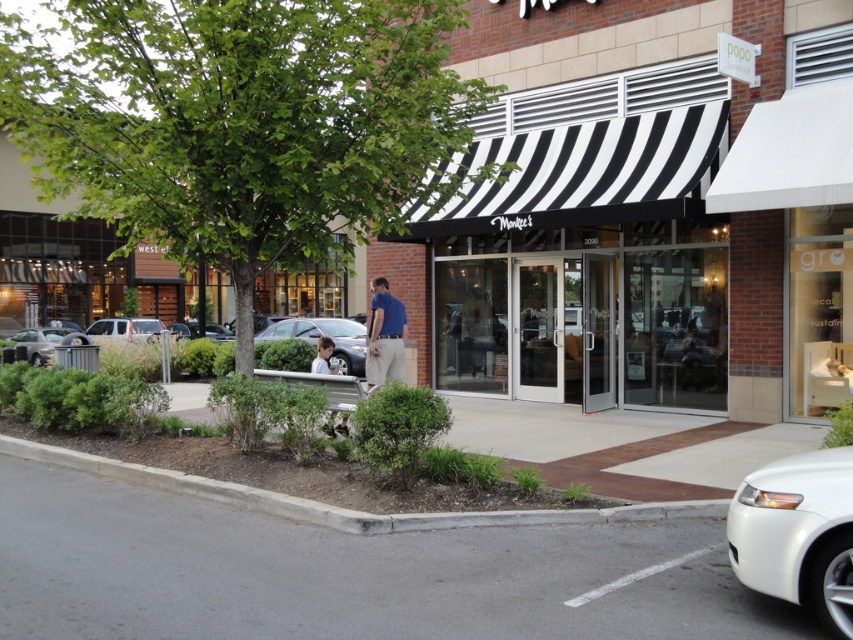
Does white glossy sedan at lower right have a lesser height compared to light blue shirt at center?

Indeed, white glossy sedan at lower right has a lesser height compared to light blue shirt at center.

The image size is (853, 640). What do you see at coordinates (798, 532) in the screenshot? I see `white glossy sedan at lower right` at bounding box center [798, 532].

This screenshot has width=853, height=640. In order to click on white glossy sedan at lower right in this screenshot , I will do `click(798, 532)`.

Measure the distance between point (395, 321) and camera.

Point (395, 321) is 36.90 feet away from camera.

Between blue cotton shirt at center and matte gray car at left, which one has more height?

Standing taller between the two is blue cotton shirt at center.

Locate an element on the screen. Image resolution: width=853 pixels, height=640 pixels. blue cotton shirt at center is located at coordinates [384, 337].

Is black and white striped awning at center to the right of matte gray car at left from the viewer's perspective?

Indeed, black and white striped awning at center is positioned on the right side of matte gray car at left.

Find the location of `black and white striped awning at center`. black and white striped awning at center is located at coordinates (646, 211).

Is point (576, 116) closer to viewer compared to point (67, 337)?

Yes, point (576, 116) is closer to viewer.

The width and height of the screenshot is (853, 640). Identify the location of black and white striped awning at center. (646, 211).